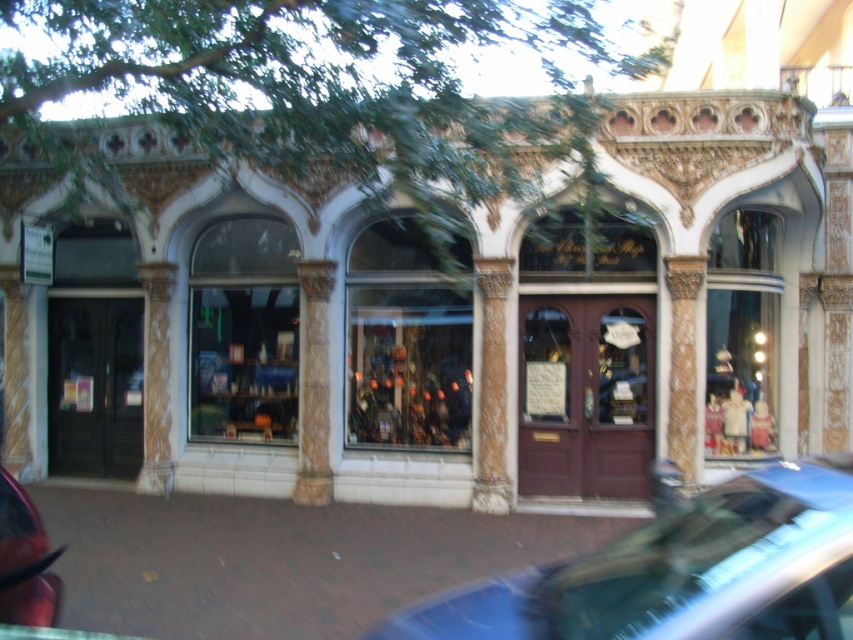
Question: Is matte glass display case at center further to camera compared to shiny red car at lower left?

Choices:
 (A) yes
 (B) no

Answer: (A)

Question: Which point is closer to the camera?

Choices:
 (A) (726, 621)
 (B) (157, 291)
 (C) (33, 515)
 (D) (438, 291)

Answer: (A)

Question: Is white stone storefront at center thinner than shiny red car at lower left?

Choices:
 (A) yes
 (B) no

Answer: (A)

Question: Which point is farther from the camera taking this photo?

Choices:
 (A) (50, 586)
 (B) (459, 627)
 (C) (194, 360)

Answer: (C)

Question: Does metallic blue car at lower right have a lesser width compared to shiny red car at lower left?

Choices:
 (A) yes
 (B) no

Answer: (B)

Question: Which of the following is the farthest from the observer?

Choices:
 (A) click(245, 371)
 (B) click(698, 500)
 (C) click(7, 573)

Answer: (A)